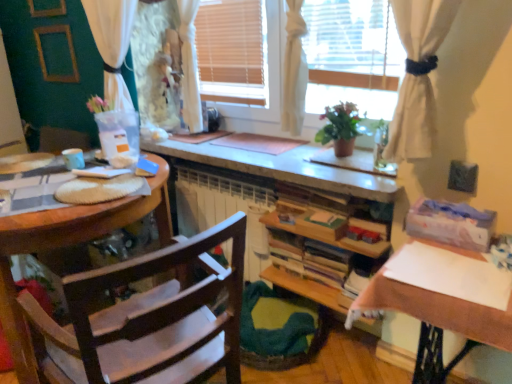
Question: Are white paper at right and white sheer curtain at upper left making contact?

Choices:
 (A) no
 (B) yes

Answer: (A)

Question: Considering the relative sizes of white paper at right and white sheer curtain at upper left in the image provided, is white paper at right taller than white sheer curtain at upper left?

Choices:
 (A) no
 (B) yes

Answer: (A)

Question: Is white paper at right oriented away from white sheer curtain at upper left?

Choices:
 (A) yes
 (B) no

Answer: (B)

Question: Can you confirm if white paper at right is shorter than white sheer curtain at upper left?

Choices:
 (A) no
 (B) yes

Answer: (B)

Question: Is white paper at right smaller than white sheer curtain at upper left?

Choices:
 (A) no
 (B) yes

Answer: (A)

Question: Is white paper at right at the right side of white sheer curtain at upper left?

Choices:
 (A) no
 (B) yes

Answer: (B)

Question: Is green matte plant at center to the left of white fabric window at center from the viewer's perspective?

Choices:
 (A) no
 (B) yes

Answer: (A)

Question: Is green matte plant at center wider than white fabric window at center?

Choices:
 (A) no
 (B) yes

Answer: (A)

Question: Considering the relative sizes of green matte plant at center and white fabric window at center in the image provided, is green matte plant at center bigger than white fabric window at center?

Choices:
 (A) no
 (B) yes

Answer: (A)

Question: Is green matte plant at center further to the viewer compared to white fabric window at center?

Choices:
 (A) no
 (B) yes

Answer: (B)

Question: Is green matte plant at center positioned with its back to white fabric window at center?

Choices:
 (A) yes
 (B) no

Answer: (A)

Question: Is white fabric window at center inside green matte plant at center?

Choices:
 (A) no
 (B) yes

Answer: (A)

Question: From the image's perspective, is white fabric window at center over wooden bookshelf at center?

Choices:
 (A) no
 (B) yes

Answer: (B)